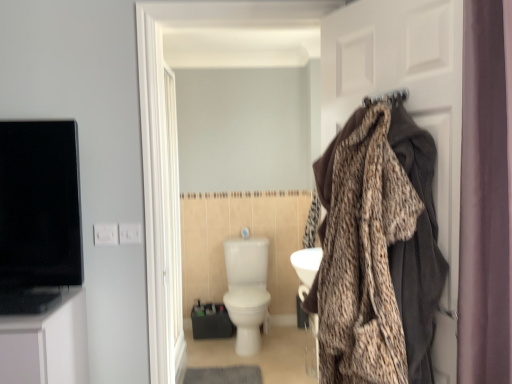
Question: Is brown fabric coat at right not within white glossy toilet at center?

Choices:
 (A) no
 (B) yes

Answer: (B)

Question: From a real-world perspective, is brown fabric coat at right over white glossy toilet at center?

Choices:
 (A) yes
 (B) no

Answer: (A)

Question: Is brown fabric coat at right surrounding white glossy toilet at center?

Choices:
 (A) yes
 (B) no

Answer: (B)

Question: Is brown fabric coat at right positioned before white glossy toilet at center?

Choices:
 (A) yes
 (B) no

Answer: (A)

Question: Is brown fabric coat at right next to white glossy toilet at center and touching it?

Choices:
 (A) yes
 (B) no

Answer: (B)

Question: From their relative heights in the image, would you say white glossy toilet at center is taller or shorter than brown fabric coat at right?

Choices:
 (A) tall
 (B) short

Answer: (B)

Question: Relative to brown fabric coat at right, is white glossy toilet at center in front or behind?

Choices:
 (A) front
 (B) behind

Answer: (B)

Question: From the image's perspective, relative to brown fabric coat at right, is white glossy toilet at center above or below?

Choices:
 (A) above
 (B) below

Answer: (B)

Question: From a real-world perspective, is white glossy toilet at center above or below brown fabric coat at right?

Choices:
 (A) below
 (B) above

Answer: (A)

Question: Relative to leopard print blanket at right, is white glossy door at center in front or behind?

Choices:
 (A) behind
 (B) front

Answer: (A)

Question: Considering the relative positions of white glossy door at center and leopard print blanket at right in the image provided, is white glossy door at center to the left or to the right of leopard print blanket at right?

Choices:
 (A) right
 (B) left

Answer: (B)

Question: Does point (165, 200) appear closer or farther from the camera than point (411, 345)?

Choices:
 (A) closer
 (B) farther

Answer: (B)

Question: From the image's perspective, relative to leopard print blanket at right, is white glossy door at center above or below?

Choices:
 (A) below
 (B) above

Answer: (A)

Question: Is leopard print blanket at right wider or thinner than white glossy toilet at center?

Choices:
 (A) thin
 (B) wide

Answer: (A)

Question: Does point (406, 327) appear closer or farther from the camera than point (241, 288)?

Choices:
 (A) farther
 (B) closer

Answer: (B)